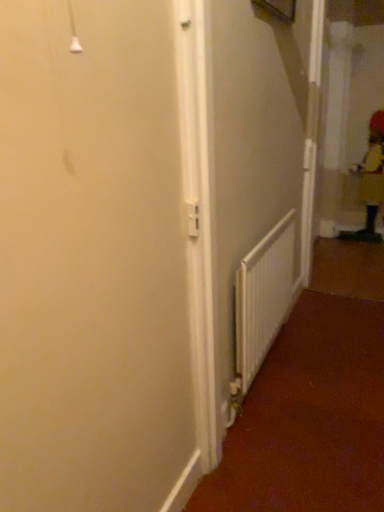
Question: From a real-world perspective, is yellow fabric worker at right over white matte radiator at center?

Choices:
 (A) no
 (B) yes

Answer: (B)

Question: Is yellow fabric worker at right placed right next to white matte radiator at center?

Choices:
 (A) no
 (B) yes

Answer: (A)

Question: Can you confirm if yellow fabric worker at right is wider than white matte radiator at center?

Choices:
 (A) no
 (B) yes

Answer: (B)

Question: Does yellow fabric worker at right come in front of white matte radiator at center?

Choices:
 (A) no
 (B) yes

Answer: (A)

Question: From the image's perspective, would you say yellow fabric worker at right is shown under white matte radiator at center?

Choices:
 (A) yes
 (B) no

Answer: (B)

Question: Is yellow fabric worker at right oriented away from white matte radiator at center?

Choices:
 (A) no
 (B) yes

Answer: (A)

Question: Is white matte radiator at center positioned with its back to yellow fabric worker at right?

Choices:
 (A) no
 (B) yes

Answer: (A)

Question: From a real-world perspective, is white matte radiator at center below yellow fabric worker at right?

Choices:
 (A) yes
 (B) no

Answer: (A)

Question: Is white matte radiator at center outside of yellow fabric worker at right?

Choices:
 (A) no
 (B) yes

Answer: (B)

Question: Is white matte radiator at center to the right of yellow fabric worker at right from the viewer's perspective?

Choices:
 (A) yes
 (B) no

Answer: (B)

Question: Can you confirm if white matte radiator at center is taller than yellow fabric worker at right?

Choices:
 (A) no
 (B) yes

Answer: (A)

Question: Considering the relative sizes of white matte radiator at center and yellow fabric worker at right in the image provided, is white matte radiator at center bigger than yellow fabric worker at right?

Choices:
 (A) yes
 (B) no

Answer: (B)

Question: From the image's perspective, relative to yellow fabric worker at right, is white matte radiator at center above or below?

Choices:
 (A) above
 (B) below

Answer: (B)